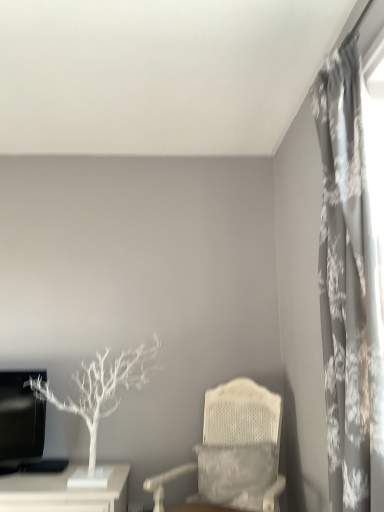
Question: Should I look upward or downward to see gray floral fabric curtain at right?

Choices:
 (A) up
 (B) down

Answer: (B)

Question: Is gray floral fabric curtain at right closer to the viewer compared to white matte tree at left?

Choices:
 (A) no
 (B) yes

Answer: (B)

Question: Could you tell me if gray floral fabric curtain at right is turned towards white matte tree at left?

Choices:
 (A) yes
 (B) no

Answer: (B)

Question: Is gray floral fabric curtain at right wider than white matte tree at left?

Choices:
 (A) yes
 (B) no

Answer: (B)

Question: Is gray floral fabric curtain at right with white matte tree at left?

Choices:
 (A) no
 (B) yes

Answer: (A)

Question: Can you confirm if gray floral fabric curtain at right is bigger than white matte tree at left?

Choices:
 (A) no
 (B) yes

Answer: (A)

Question: Does gray floral fabric curtain at right come behind white matte tree at left?

Choices:
 (A) no
 (B) yes

Answer: (A)

Question: From the image's perspective, is gray floral fabric curtain at right on top of white textured chair at center?

Choices:
 (A) no
 (B) yes

Answer: (B)

Question: Is gray floral fabric curtain at right facing towards white textured chair at center?

Choices:
 (A) no
 (B) yes

Answer: (A)

Question: Is gray floral fabric curtain at right shorter than white textured chair at center?

Choices:
 (A) yes
 (B) no

Answer: (B)

Question: Is white textured chair at center surrounded by gray floral fabric curtain at right?

Choices:
 (A) yes
 (B) no

Answer: (B)

Question: Does gray floral fabric curtain at right have a larger size compared to white textured chair at center?

Choices:
 (A) yes
 (B) no

Answer: (B)

Question: Is gray floral fabric curtain at right beside white textured chair at center?

Choices:
 (A) yes
 (B) no

Answer: (B)

Question: Can you see white textured chair at center touching white matte tree at left?

Choices:
 (A) no
 (B) yes

Answer: (A)